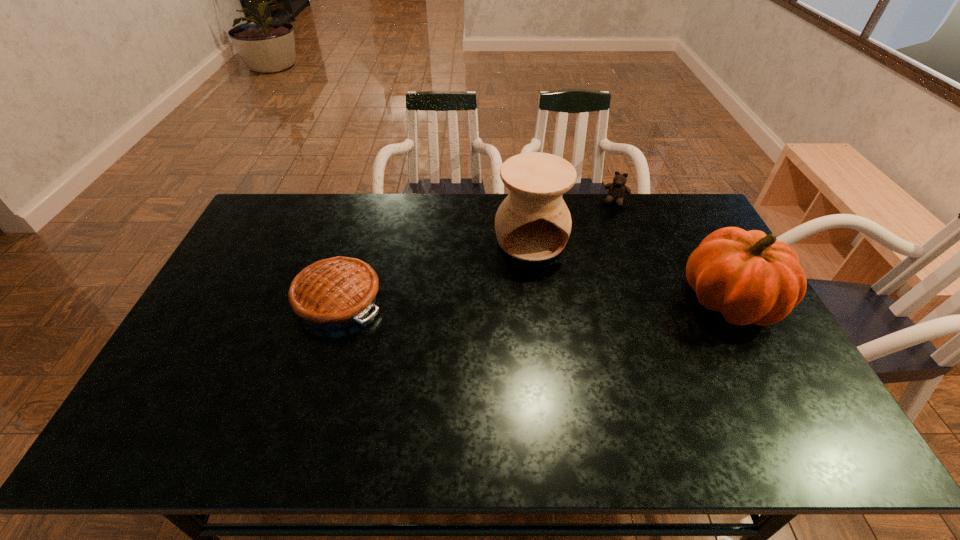
Where is `unoccupied area between the second object from right to left and the leftmost object`? The image size is (960, 540). unoccupied area between the second object from right to left and the leftmost object is located at coordinates (477, 251).

This screenshot has height=540, width=960. Identify the location of free space between the third nearest object and the leftmost object. (435, 269).

Locate an element on the screen. This screenshot has height=540, width=960. free space between the third object from right to left and the pumpkin is located at coordinates (631, 269).

Find the location of a particular element. The image size is (960, 540). object that is the closest to the rightmost object is located at coordinates (533, 223).

At what (x,y) coordinates should I click in order to perform the action: click on object that stands as the closest to the pumpkin. Please return your answer as a coordinate pair (x, y). This screenshot has height=540, width=960. Looking at the image, I should click on (533, 223).

You are a GUI agent. You are given a task and a screenshot of the screen. Output one action in this format:
    pyautogui.click(x=<x>, y=<y>)
    Task: Click on the free space that satisfies the following two spatial constraints: 1. on the front side of the rightmost object; 2. on the left side of the teddy bear
    The height and width of the screenshot is (540, 960).
    Given the screenshot: What is the action you would take?
    pyautogui.click(x=653, y=300)